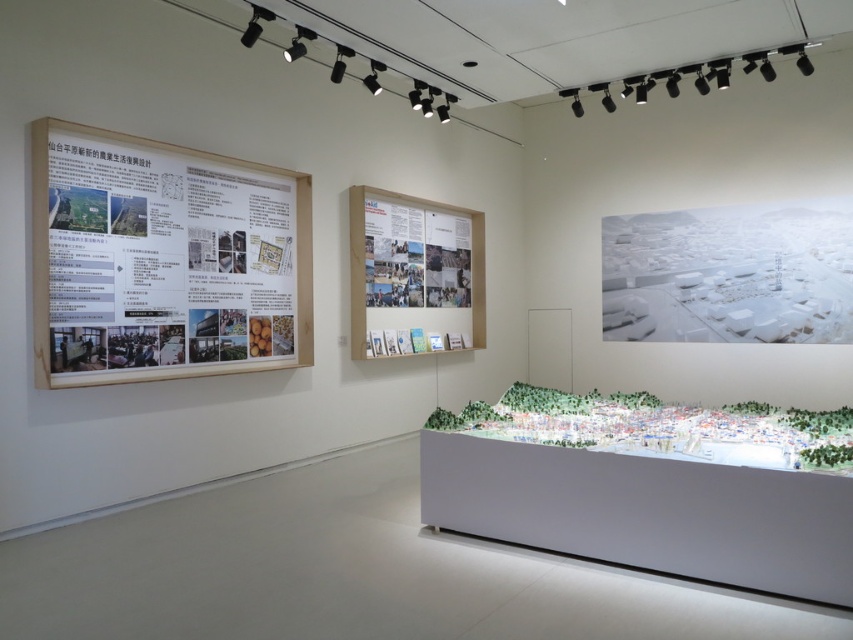
You are standing in the exhibition space and want to know how far the point at coordinates (608, 272) is from your current position. Can you determine the distance?

The point at coordinates (608, 272) is 7.75 meters away from your current position.

You are a visitor in the exhibition space. You see both the white matte cityscape at center and the matte paper poster at center. Which one is positioned lower in the scene?

The white matte cityscape at center is positioned lower than the matte paper poster at center.

You are an art student visiting the exhibition and want to take a photo of both the white matte cityscape at center and the matte paper poster at center. Since you want to include both in the frame, which object should you position closer to the camera to ensure both fit in the photo?

Since the white matte cityscape at center is bigger than the matte paper poster at center, you should position the matte paper poster at center closer to the camera to compensate for its smaller size and ensure both fit within the frame.